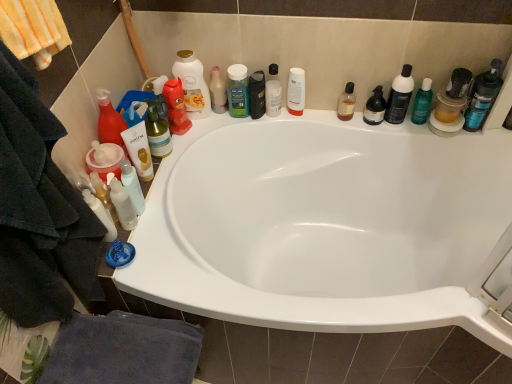
Question: Could you tell me if white glossy lotion at lower left, placed as the 1th toiletry when sorted from left to right, is turned towards green glossy bottle at upper right, marked as the 1th toiletry in a right-to-left arrangement?

Choices:
 (A) no
 (B) yes

Answer: (A)

Question: From the image's perspective, does white glossy lotion at lower left, marked as the 7th toiletry in a right-to-left arrangement, appear higher than green glossy bottle at upper right, marked as the 1th toiletry in a right-to-left arrangement?

Choices:
 (A) no
 (B) yes

Answer: (A)

Question: Does white glossy lotion at lower left, placed as the 1th toiletry when sorted from left to right, come behind green glossy bottle at upper right, arranged as the seventh toiletry when viewed from the left?

Choices:
 (A) yes
 (B) no

Answer: (B)

Question: Does white glossy lotion at lower left, placed as the 1th toiletry when sorted from left to right, appear on the left side of green glossy bottle at upper right, arranged as the seventh toiletry when viewed from the left?

Choices:
 (A) no
 (B) yes

Answer: (B)

Question: Does white glossy lotion at lower left, marked as the 7th toiletry in a right-to-left arrangement, have a greater width compared to green glossy bottle at upper right, arranged as the seventh toiletry when viewed from the left?

Choices:
 (A) yes
 (B) no

Answer: (A)

Question: Is black matte bottle at center taller or shorter than white matte bottle at upper center, arranged as the 3th mouthwash when viewed from the right?

Choices:
 (A) short
 (B) tall

Answer: (A)

Question: Based on their sizes in the image, would you say black matte bottle at center is bigger or smaller than white matte bottle at upper center, arranged as the 3th mouthwash when viewed from the right?

Choices:
 (A) big
 (B) small

Answer: (A)

Question: From a real-world perspective, is black matte bottle at center above or below white matte bottle at upper center, the 4th mouthwash when ordered from left to right?

Choices:
 (A) above
 (B) below

Answer: (B)

Question: From the image's perspective, is black matte bottle at center located above or below white matte bottle at upper center, arranged as the 3th mouthwash when viewed from the right?

Choices:
 (A) below
 (B) above

Answer: (A)

Question: From a real-world perspective, is white glossy lotion at lower left, placed as the 1th toiletry when sorted from left to right, physically located above or below translucent amber liquid at upper right, the 2th mouthwash viewed from the right?

Choices:
 (A) above
 (B) below

Answer: (A)

Question: Considering the positions of white glossy lotion at lower left, marked as the 7th toiletry in a right-to-left arrangement, and translucent amber liquid at upper right, acting as the 5th mouthwash starting from the left, in the image, is white glossy lotion at lower left, marked as the 7th toiletry in a right-to-left arrangement, bigger or smaller than translucent amber liquid at upper right, acting as the 5th mouthwash starting from the left,?

Choices:
 (A) big
 (B) small

Answer: (A)

Question: Is white glossy lotion at lower left, placed as the 1th toiletry when sorted from left to right, wider or thinner than translucent amber liquid at upper right, the 2th mouthwash viewed from the right?

Choices:
 (A) wide
 (B) thin

Answer: (A)

Question: Is white glossy lotion at lower left, marked as the 7th toiletry in a right-to-left arrangement, in front of or behind translucent amber liquid at upper right, acting as the 5th mouthwash starting from the left, in the image?

Choices:
 (A) behind
 (B) front

Answer: (B)

Question: From a real-world perspective, relative to white glossy bottle at lower left, the sixth mouthwash in the right-to-left sequence, is translucent plastic bottle at upper center, marked as the fifth toiletry in a left-to-right arrangement, vertically above or below?

Choices:
 (A) below
 (B) above

Answer: (B)

Question: From their relative heights in the image, would you say translucent plastic bottle at upper center, marked as the fifth toiletry in a left-to-right arrangement, is taller or shorter than white glossy bottle at lower left, the sixth mouthwash in the right-to-left sequence?

Choices:
 (A) short
 (B) tall

Answer: (B)